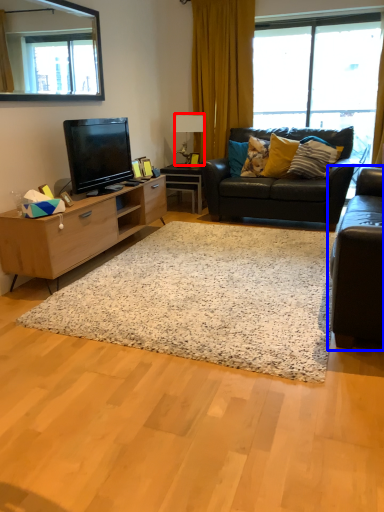
Question: Which object is closer to the camera taking this photo, lamp (highlighted by a red box) or studio couch (highlighted by a blue box)?

Choices:
 (A) lamp
 (B) studio couch

Answer: (B)